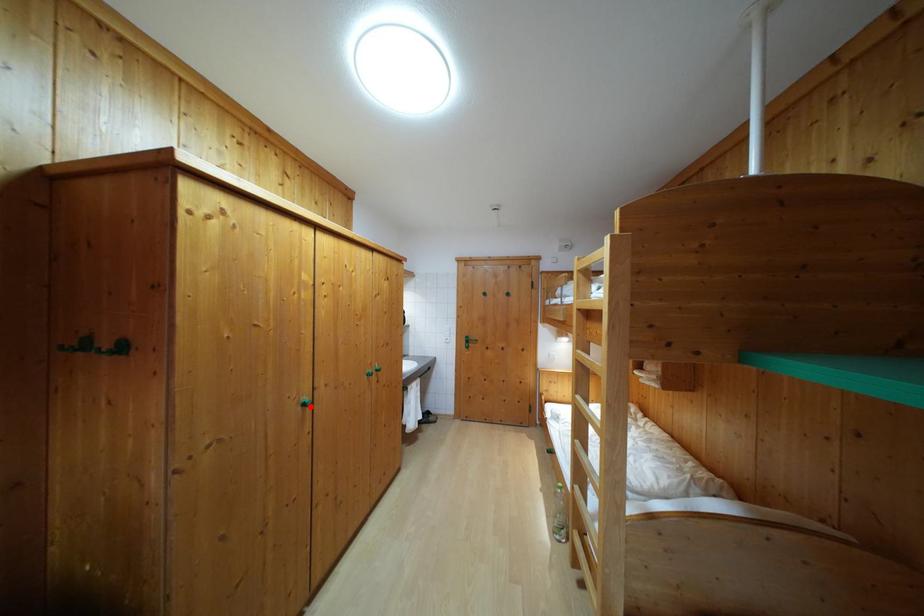
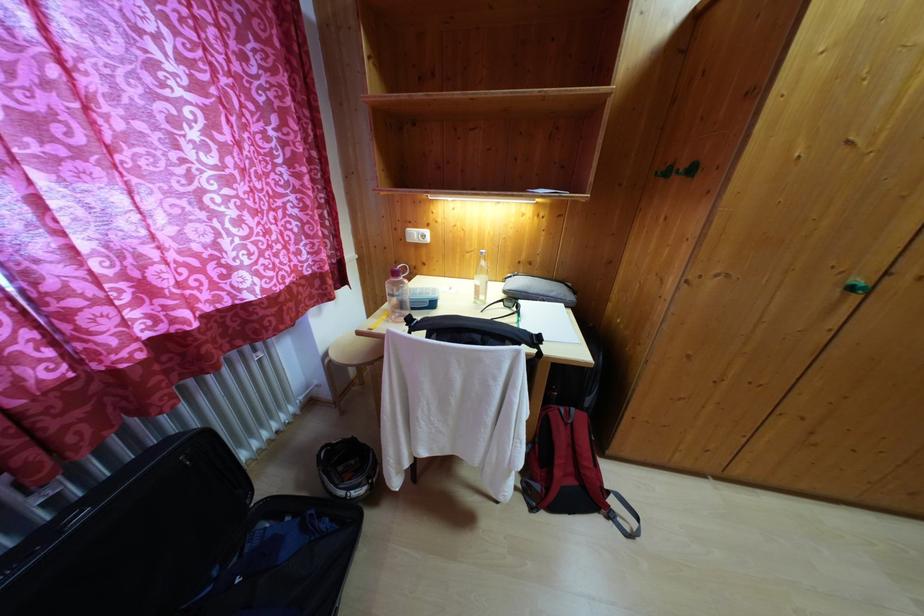
The point at the highlighted location is marked in the first image. Where is the corresponding point in the second image?

(866, 290)